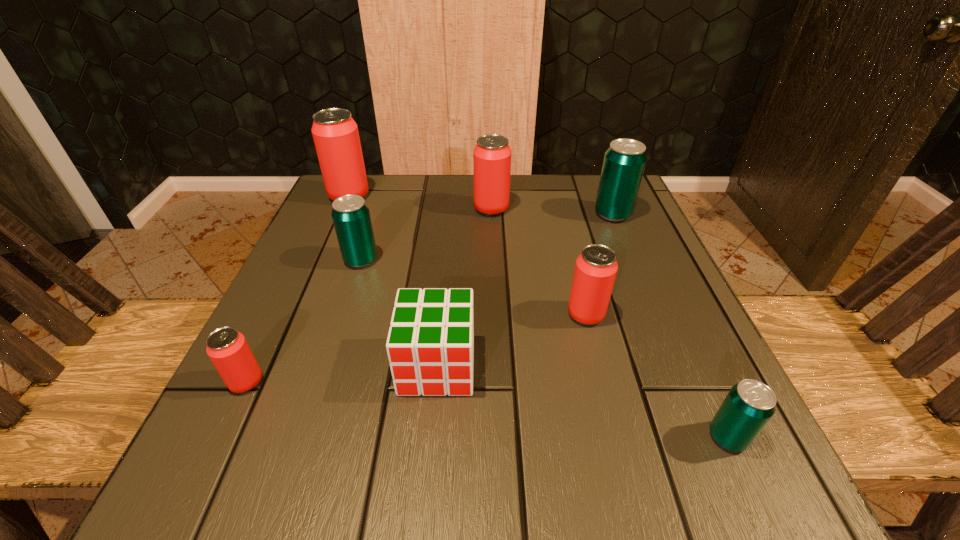
The image size is (960, 540). Find the location of `free spot located on the left of the nearest beer can`. free spot located on the left of the nearest beer can is located at coordinates (612, 437).

Identify the location of vacant space located 0.360m on the back of the nearest red beer can. (318, 233).

The height and width of the screenshot is (540, 960). Identify the location of object that is at the near edge. (750, 404).

At what (x,y) coordinates should I click in order to perform the action: click on object that is at the far left corner. Please return your answer as a coordinate pair (x, y). Looking at the image, I should click on (335, 133).

The width and height of the screenshot is (960, 540). Identify the location of object positioned at the far right corner. (624, 161).

This screenshot has width=960, height=540. I want to click on object that is at the near right corner, so click(750, 404).

This screenshot has height=540, width=960. I want to click on vacant space at the far edge, so click(564, 223).

I want to click on vacant area at the near edge, so click(505, 481).

This screenshot has width=960, height=540. In the image, there is a desktop. Find the location of `vacant area at the left edge`. vacant area at the left edge is located at coordinates tap(276, 378).

Identify the location of vacant area at the right edge. (644, 417).